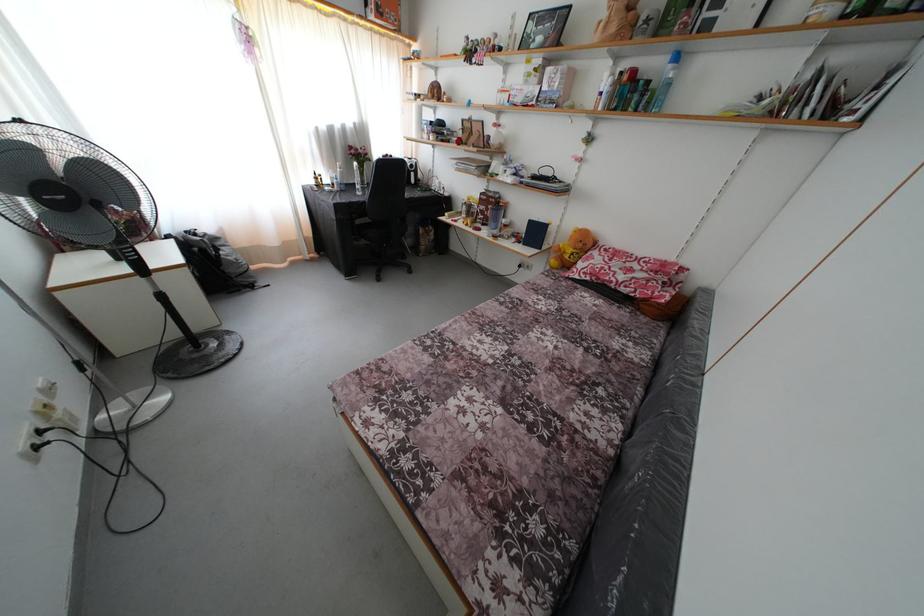
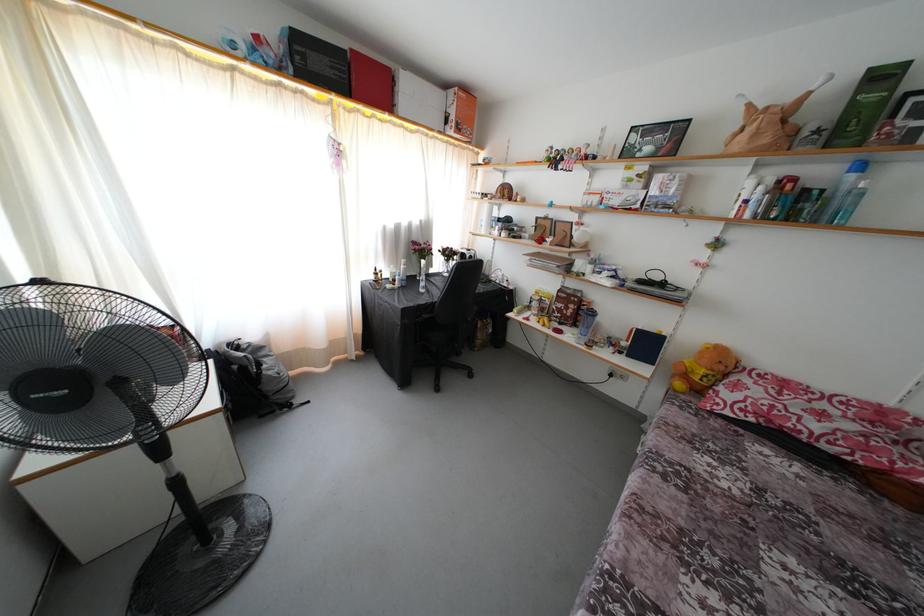
Locate, in the second image, the point that corresponds to [673,63] in the first image.

(849, 172)